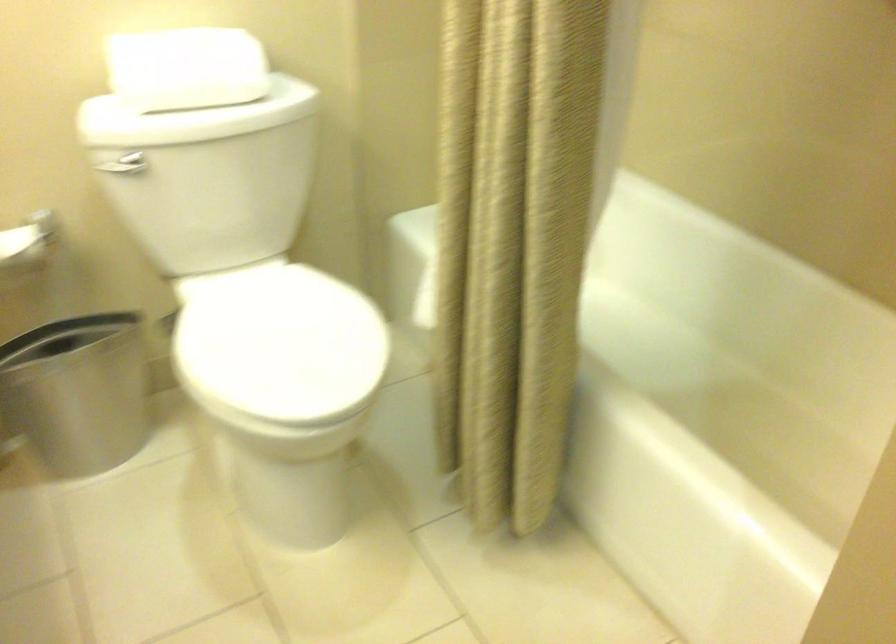
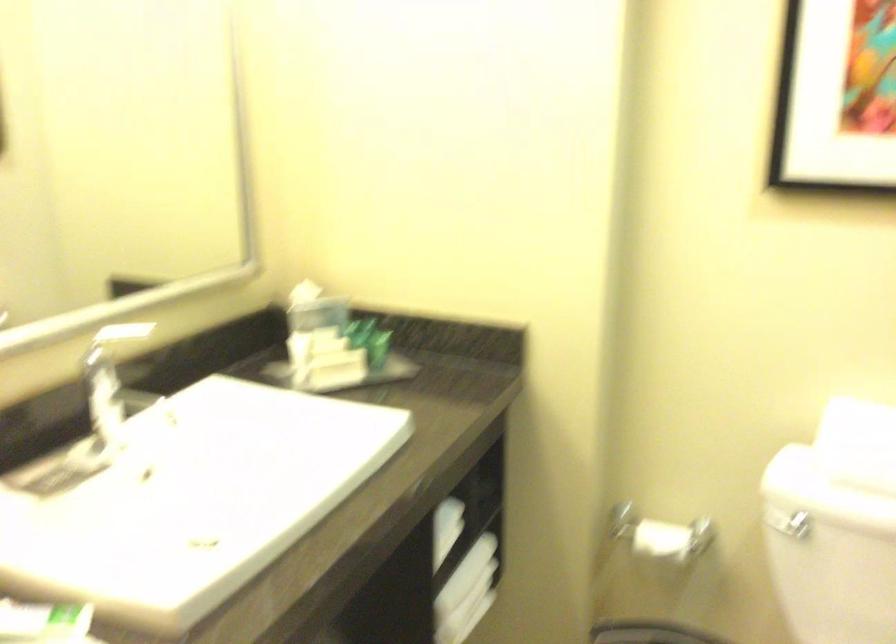
Question: How did the camera likely rotate?

Choices:
 (A) Left
 (B) Right
 (C) Up
 (D) Down

Answer: (A)